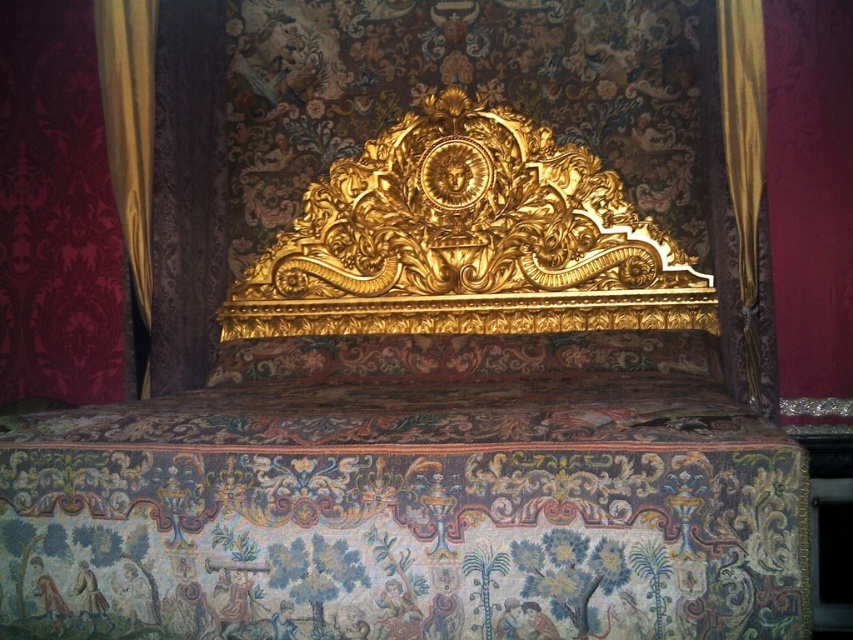
Question: Does gold fabric curtain at left appear on the left side of gold fabric curtain at right?

Choices:
 (A) yes
 (B) no

Answer: (A)

Question: Among these objects, which one is nearest to the camera?

Choices:
 (A) gold fabric curtain at left
 (B) gold fabric curtain at right

Answer: (B)

Question: Can you confirm if gold fabric curtain at left is positioned to the right of gold fabric curtain at right?

Choices:
 (A) yes
 (B) no

Answer: (B)

Question: Is gold fabric curtain at left positioned behind gold fabric curtain at right?

Choices:
 (A) no
 (B) yes

Answer: (B)